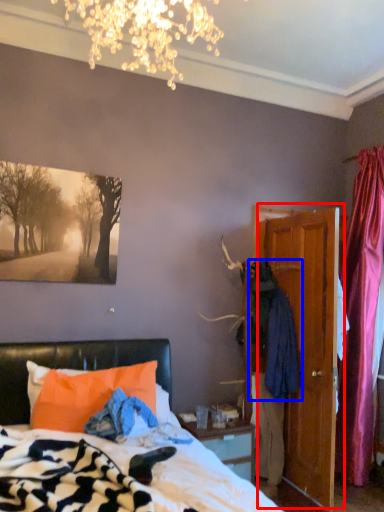
Question: Among these objects, which one is nearest to the camera, door (highlighted by a red box) or clothing (highlighted by a blue box)?

Choices:
 (A) door
 (B) clothing

Answer: (A)